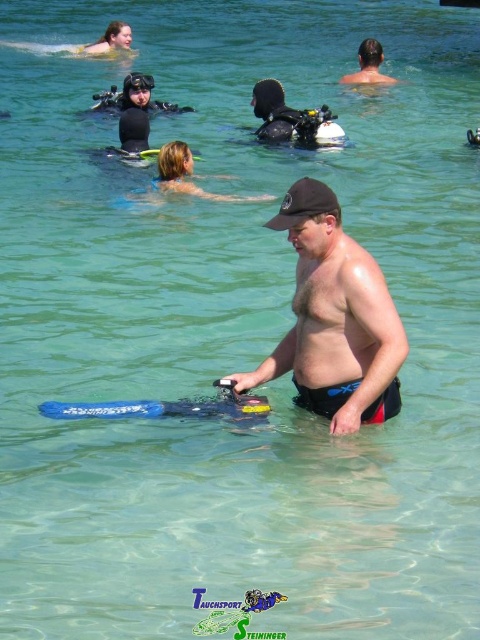
Question: Estimate the real-world distances between objects in this image. Which object is closer to the matte black cap at center?

Choices:
 (A) black matte scuba gear at center
 (B) black matte snorkel mask at upper center

Answer: (A)

Question: Which object is closer to the camera taking this photo?

Choices:
 (A) black matte scuba gear at center
 (B) black matte snorkel mask at upper center
 (C) matte black cap at center

Answer: (C)

Question: Is matte black cap at center bigger than black matte scuba gear at center?

Choices:
 (A) yes
 (B) no

Answer: (A)

Question: Among these points, which one is nearest to the camera?

Choices:
 (A) (384, 348)
 (B) (276, 125)

Answer: (A)

Question: Where is matte black cap at center located in relation to black matte scuba gear at center in the image?

Choices:
 (A) below
 (B) above

Answer: (A)

Question: Does matte black cap at center appear over black matte scuba gear at center?

Choices:
 (A) no
 (B) yes

Answer: (A)